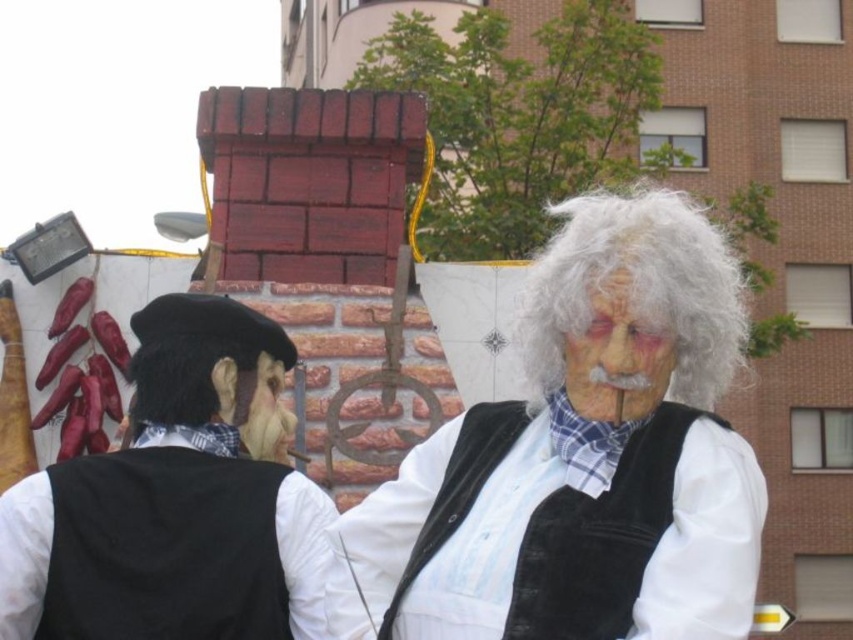
Question: Where is black velvet beret at left located in relation to velvet vest at center in the image?

Choices:
 (A) right
 (B) left

Answer: (B)

Question: Which point is farther to the camera?

Choices:
 (A) (241, 547)
 (B) (602, 300)
 (C) (695, 307)

Answer: (B)

Question: Among these points, which one is farthest from the camera?

Choices:
 (A) (746, 312)
 (B) (291, 595)
 (C) (619, 397)
 (D) (496, 531)

Answer: (A)

Question: Which is farther from the white matte vest at center?

Choices:
 (A) white curly wig at center
 (B) velvet vest at center
 (C) black velvet beret at left

Answer: (C)

Question: Observing the image, what is the correct spatial positioning of white matte vest at center in reference to white matte face at center?

Choices:
 (A) below
 (B) above

Answer: (B)

Question: Where is white matte vest at center located in relation to white curly wig at center in the image?

Choices:
 (A) above
 (B) below

Answer: (A)